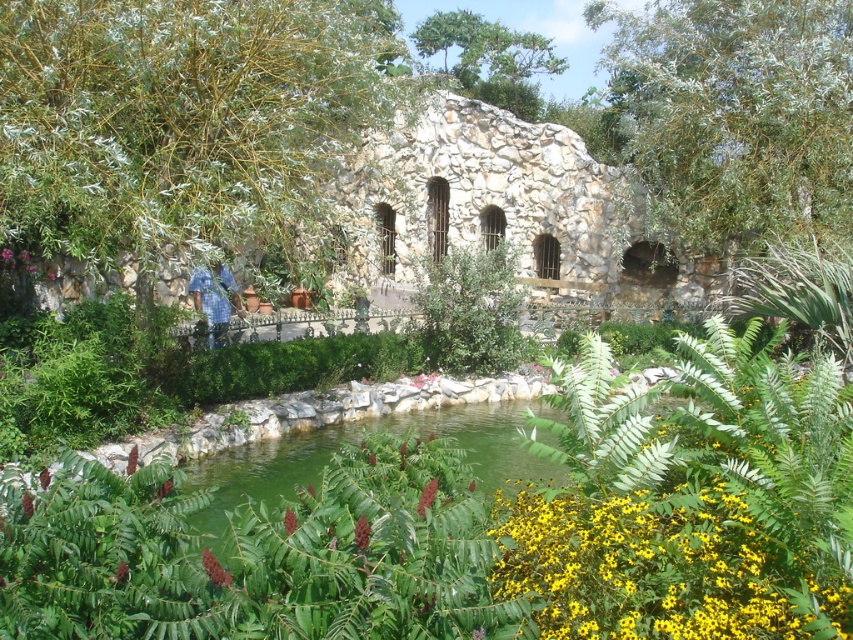
Question: Does burgundy matte flower at center appear on the left side of purple matte flower at center?

Choices:
 (A) no
 (B) yes

Answer: (A)

Question: Does green matte flower at lower center appear on the right side of purple matte flower at center?

Choices:
 (A) no
 (B) yes

Answer: (B)

Question: Does vivid red flower at center appear over purple matte flower at center?

Choices:
 (A) yes
 (B) no

Answer: (B)

Question: Among these objects, which one is farthest from the camera?

Choices:
 (A) vivid red flower at center
 (B) blue plaid shirt at center
 (C) purple matte flower at center

Answer: (C)

Question: Which of the following is the farthest from the observer?

Choices:
 (A) burgundy matte flower at center
 (B) green matte flower at lower center
 (C) red matte flower at center
 (D) blue plaid shirt at center

Answer: (D)

Question: Which object appears farthest from the camera in this image?

Choices:
 (A) green matte flower at lower center
 (B) purple matte flower at center

Answer: (B)